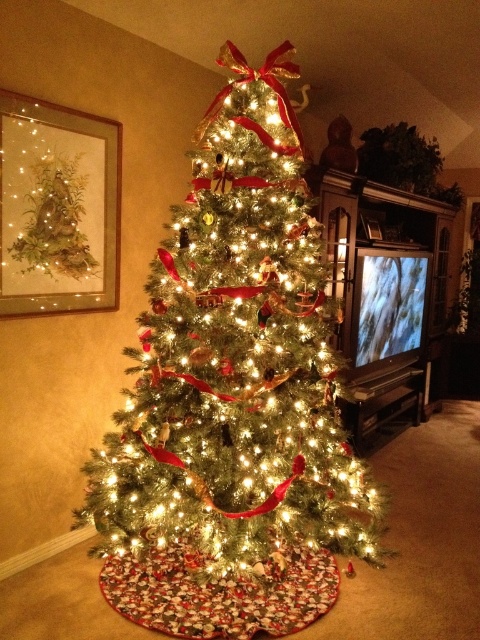
Question: Which point is closer to the camera?

Choices:
 (A) (275, 364)
 (B) (51, 141)

Answer: (A)

Question: Where is iridescent glass christmas tree at center located in relation to matte glass painting at upper left in the image?

Choices:
 (A) below
 (B) above

Answer: (A)

Question: Observing the image, what is the correct spatial positioning of iridescent glass christmas tree at center in reference to matte glass painting at upper left?

Choices:
 (A) below
 (B) above

Answer: (A)

Question: Is iridescent glass christmas tree at center to the right of matte glass painting at upper left from the viewer's perspective?

Choices:
 (A) no
 (B) yes

Answer: (B)

Question: Which point is closer to the camera taking this photo?

Choices:
 (A) (17, 106)
 (B) (253, 541)

Answer: (B)